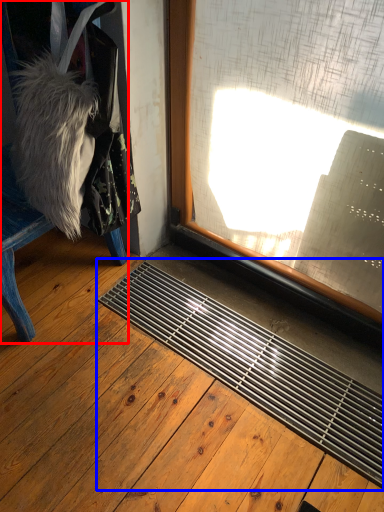
Question: Among these objects, which one is farthest to the camera, furniture (highlighted by a red box) or doormat (highlighted by a blue box)?

Choices:
 (A) furniture
 (B) doormat

Answer: (A)